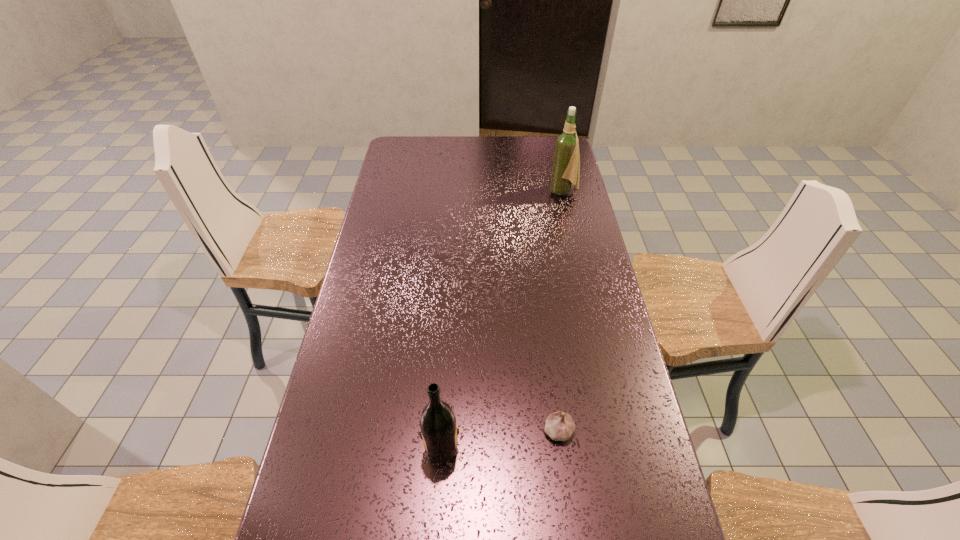
At what (x,y) coordinates should I click in order to perform the action: click on vacant area situated 0.140m on the right of the garlic. Please return your answer as a coordinate pair (x, y). The width and height of the screenshot is (960, 540). Looking at the image, I should click on (630, 430).

Where is `object present at the right edge`? The height and width of the screenshot is (540, 960). object present at the right edge is located at coordinates (566, 165).

This screenshot has height=540, width=960. In the image, there is a desktop. Find the location of `vacant space at the far edge`. vacant space at the far edge is located at coordinates (441, 140).

The image size is (960, 540). In the image, there is a desktop. In order to click on free space at the left edge in this screenshot , I will do `click(350, 447)`.

Locate an element on the screen. The width and height of the screenshot is (960, 540). free spot at the right edge of the desktop is located at coordinates (572, 370).

Identify the location of free point between the farther wine bottle and the second shortest object. The height and width of the screenshot is (540, 960). (501, 319).

Where is `unoccupied position between the second object from left to right and the leftmost object`? This screenshot has width=960, height=540. unoccupied position between the second object from left to right and the leftmost object is located at coordinates (498, 438).

Locate an element on the screen. The image size is (960, 540). free spot between the second object from right to left and the rightmost object is located at coordinates (561, 311).

Locate an element on the screen. The height and width of the screenshot is (540, 960). vacant area that lies between the tallest object and the left wine bottle is located at coordinates (501, 319).

Identify the location of free spot between the second object from left to right and the leftmost object. (498, 438).